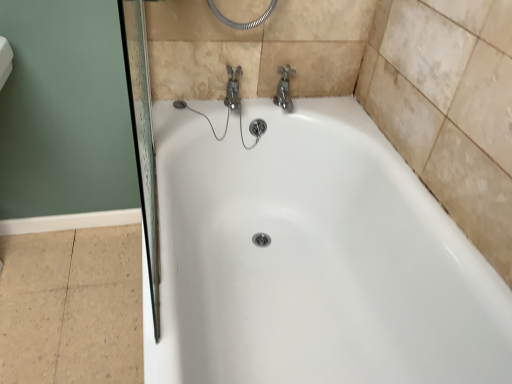
Question: Does point (281, 100) appear closer or farther from the camera than point (232, 221)?

Choices:
 (A) closer
 (B) farther

Answer: (A)

Question: From a real-world perspective, is chrome metallic faucet at upper center above or below white glossy bathtub at center?

Choices:
 (A) below
 (B) above

Answer: (B)

Question: From the image's perspective, is chrome metallic faucet at upper center above or below white glossy bathtub at center?

Choices:
 (A) above
 (B) below

Answer: (A)

Question: Is point (375, 196) closer or farther from the camera than point (293, 72)?

Choices:
 (A) farther
 (B) closer

Answer: (B)

Question: From a real-world perspective, is white glossy bathtub at center positioned above or below chrome metallic faucet at upper center?

Choices:
 (A) below
 (B) above

Answer: (A)

Question: Is white glossy bathtub at center inside the boundaries of chrome metallic faucet at upper center, or outside?

Choices:
 (A) outside
 (B) inside

Answer: (A)

Question: In terms of size, does white glossy bathtub at center appear bigger or smaller than chrome metallic faucet at upper center?

Choices:
 (A) small
 (B) big

Answer: (B)